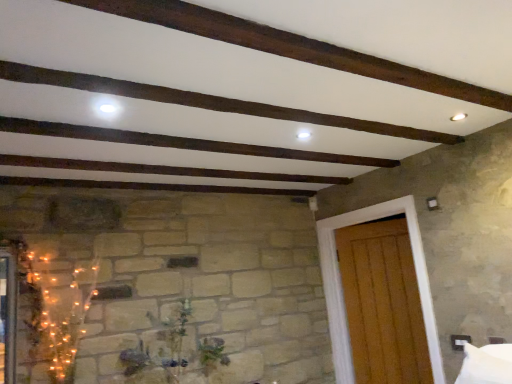
Question: Should I look upward or downward to see green matte plant at center?

Choices:
 (A) down
 (B) up

Answer: (A)

Question: Is wooden door at right closer to camera compared to green matte plant at center?

Choices:
 (A) yes
 (B) no

Answer: (B)

Question: Does wooden door at right appear on the right side of green matte plant at center?

Choices:
 (A) yes
 (B) no

Answer: (A)

Question: Does wooden door at right have a lesser width compared to green matte plant at center?

Choices:
 (A) no
 (B) yes

Answer: (B)

Question: Is green matte plant at center a part of wooden door at right?

Choices:
 (A) yes
 (B) no

Answer: (B)

Question: Are wooden door at right and green matte plant at center far apart?

Choices:
 (A) no
 (B) yes

Answer: (B)

Question: From a real-world perspective, is wooden door at right below green matte plant at center?

Choices:
 (A) no
 (B) yes

Answer: (A)

Question: Does green matte plant at center have a lesser width compared to wooden door at right?

Choices:
 (A) yes
 (B) no

Answer: (B)

Question: Can you confirm if green matte plant at center is bigger than wooden door at right?

Choices:
 (A) no
 (B) yes

Answer: (A)

Question: From the image's perspective, is green matte plant at center above wooden door at right?

Choices:
 (A) yes
 (B) no

Answer: (B)

Question: Considering the relative positions of green matte plant at center and wooden door at right in the image provided, is green matte plant at center to the left of wooden door at right from the viewer's perspective?

Choices:
 (A) yes
 (B) no

Answer: (A)

Question: Is green matte plant at center positioned in front of wooden door at right?

Choices:
 (A) no
 (B) yes

Answer: (B)

Question: Considering the relative sizes of green matte plant at center and wooden door at right in the image provided, is green matte plant at center taller than wooden door at right?

Choices:
 (A) no
 (B) yes

Answer: (A)

Question: Is wooden door at right spatially inside green matte plant at center, or outside of it?

Choices:
 (A) inside
 (B) outside

Answer: (B)